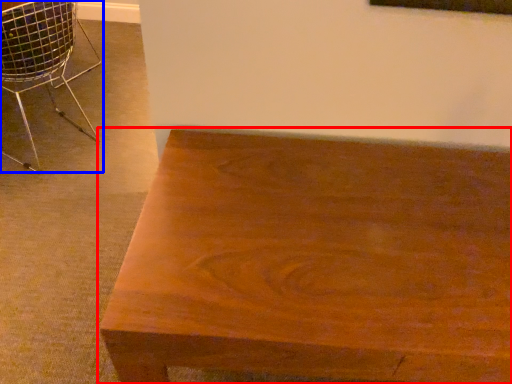
Question: Which object appears closest to the camera in this image, table (highlighted by a red box) or chair (highlighted by a blue box)?

Choices:
 (A) table
 (B) chair

Answer: (A)